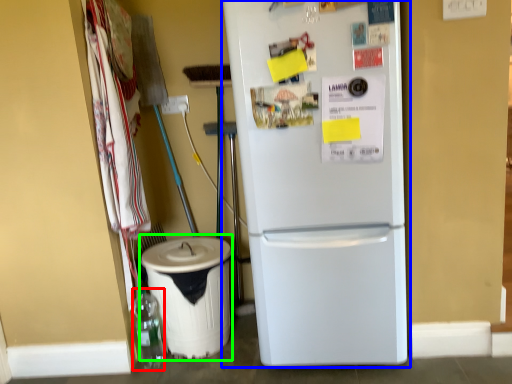
Question: Which object is the farthest from bottle (highlighted by a red box)? Choose among these: refrigerator (highlighted by a blue box) or recycling bin (highlighted by a green box).

Choices:
 (A) refrigerator
 (B) recycling bin

Answer: (A)